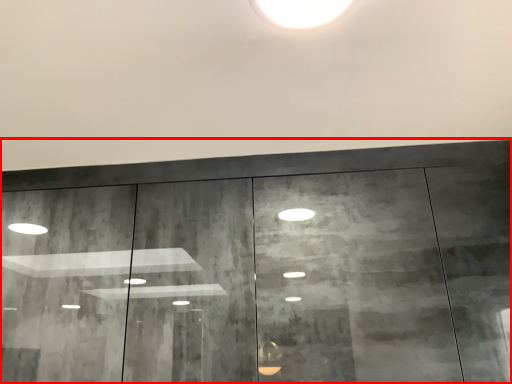
Question: Considering the relative positions of door (annotated by the red box) and light in the image provided, where is door (annotated by the red box) located with respect to the staircase?

Choices:
 (A) left
 (B) right

Answer: (A)